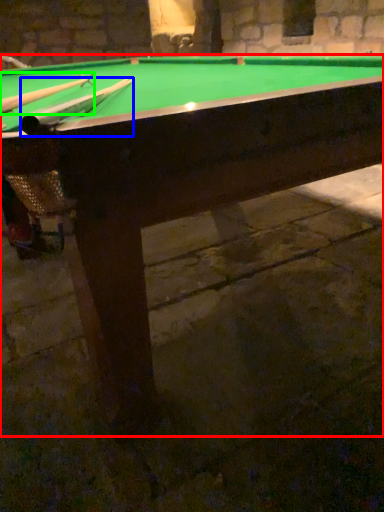
Question: Based on their relative distances, which object is farther from billiard table (highlighted by a red box)? Choose from cue (highlighted by a blue box) and cue (highlighted by a green box).

Choices:
 (A) cue
 (B) cue

Answer: (B)